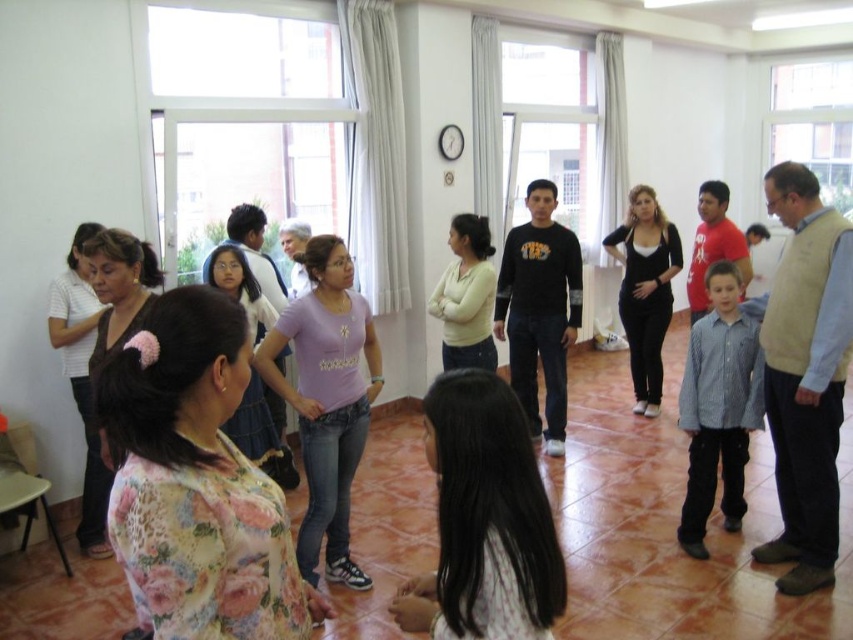
What is located at the coordinates point (485,520) in the image?

The point (485,520) corresponds to light brown hair at center.

You are organizing a photo shoot and need to ensure that all participants are visible in the frame. You notice the beige sweater vest at right and the blue striped shirt at lower right. Which participant should you ask to move closer to the camera to ensure both are visible?

The beige sweater vest at right is bigger than the blue striped shirt at lower right, so you should ask the participant wearing the beige sweater vest at right to move closer to the camera to ensure both are visible.